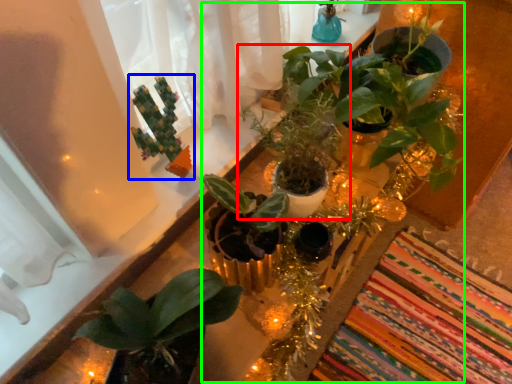
Question: Which object is the closest to the houseplant (highlighted by a red box)? Choose among these: houseplant (highlighted by a blue box) or floral arrangement (highlighted by a green box).

Choices:
 (A) houseplant
 (B) floral arrangement

Answer: (B)